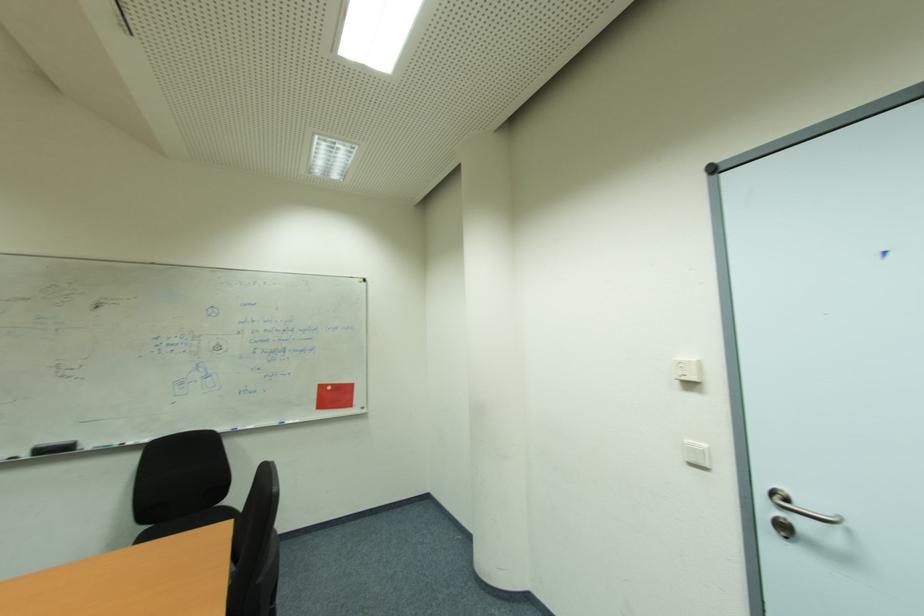
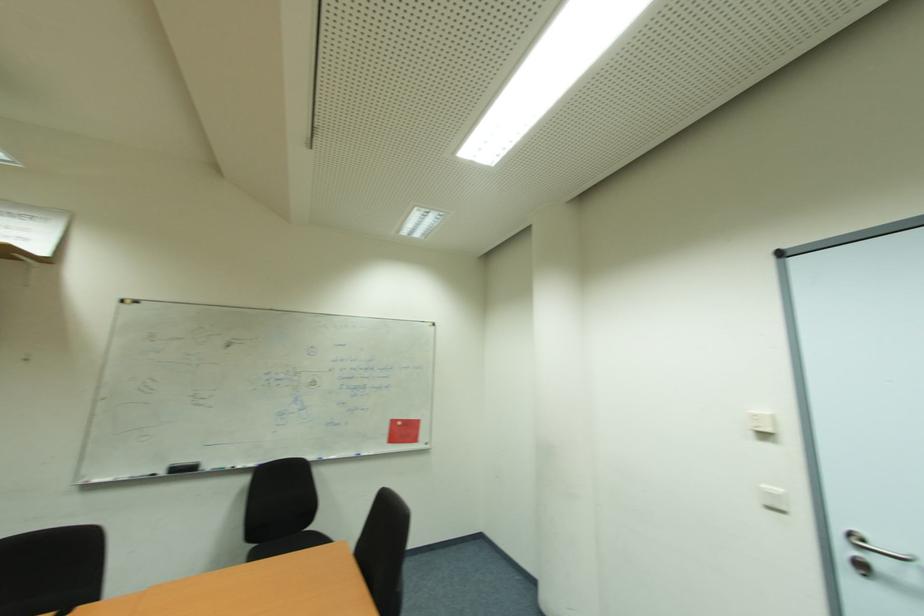
The point at (x=58, y=453) is marked in the first image. Where is the corresponding point in the second image?

(189, 469)